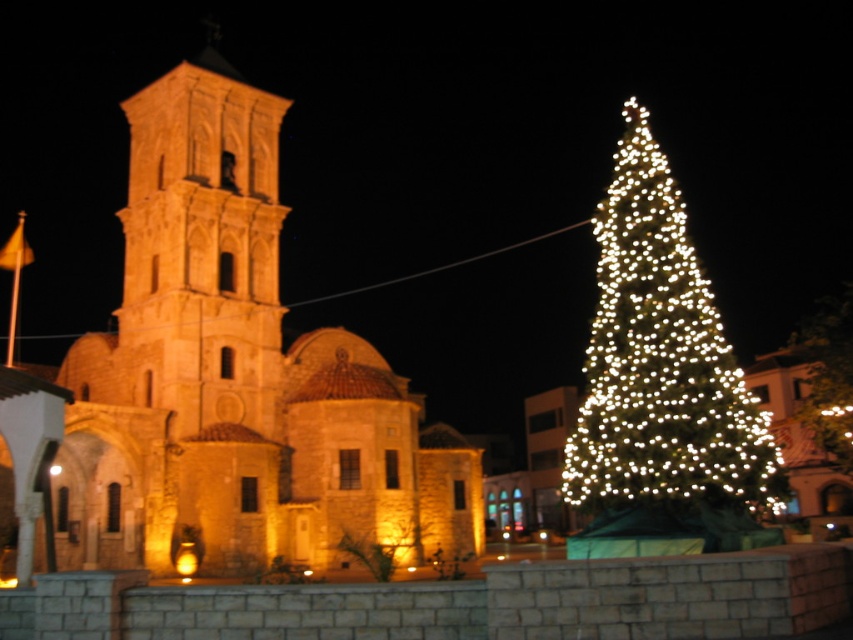
Between golden stone church at center and illuminated green pine at right, which one has more height?

illuminated green pine at right

Between golden stone church at center and illuminated green pine at right, which one is positioned lower?

golden stone church at center is below.

The image size is (853, 640). Describe the element at coordinates (236, 376) in the screenshot. I see `golden stone church at center` at that location.

Where is `golden stone church at center`? golden stone church at center is located at coordinates (236, 376).

Is golden stone church at center taller than golden stone tower at left?

Yes, golden stone church at center is taller than golden stone tower at left.

Measure the distance between point (165, 179) and camera.

A distance of 238.46 feet exists between point (165, 179) and camera.

This screenshot has width=853, height=640. I want to click on golden stone church at center, so (x=236, y=376).

Is golden stone tower at left above illuminated glass christmas tree at center?

Correct, golden stone tower at left is located above illuminated glass christmas tree at center.

Identify the location of golden stone tower at left. Image resolution: width=853 pixels, height=640 pixels. (201, 250).